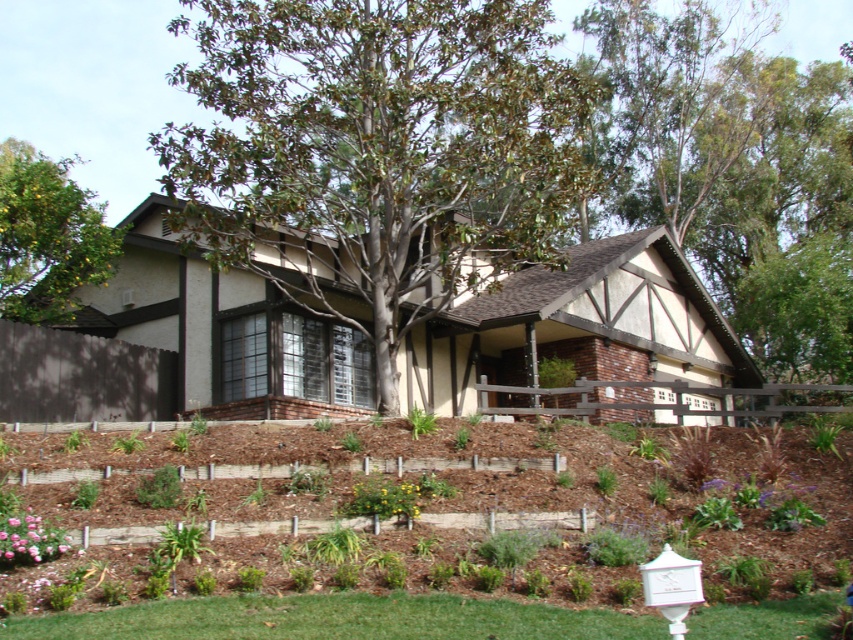
You are standing in the garden of the Tudor house and want to plant a new flower. You have two spots marked by coordinates point (531,259) and point (764,252). Which coordinate is closer to the house?

Point (531,259) is in front of point (764,252), so it is closer to the house.

You are a gardener who needs to plant a new shrub that requires 2 meters of space between it and the mulched soil at lower center. Can you place the shrub where the pink matte flower at lower left is currently growing?

The distance between the mulched soil at lower center and the pink matte flower at lower left is 2.64 meters, which is more than the required 2 meters. Therefore, the shrub can be planted where the pink matte flower at lower left is currently growing.